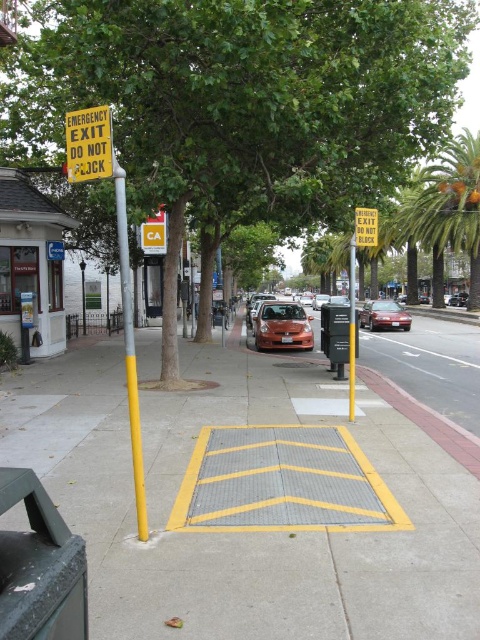
Question: Can you confirm if yellow textured pavement at center is wider than yellow metallic pole at center?

Choices:
 (A) no
 (B) yes

Answer: (A)

Question: Which point is closer to the camera?

Choices:
 (A) green leafy tree at center
 (B) yellow paper sign at upper left

Answer: (B)

Question: Which object is positioned farthest from the shiny red car at center?

Choices:
 (A) yellow plastic sign at upper center
 (B) yellow textured pavement at center
 (C) yellow metallic pole at center
 (D) yellow paper sign at upper left

Answer: (D)

Question: Observing the image, what is the correct spatial positioning of green leafy tree at center in reference to shiny red car at center?

Choices:
 (A) left
 (B) right

Answer: (A)

Question: Estimate the real-world distances between objects in this image. Which object is closer to the yellow paper sign at upper left?

Choices:
 (A) yellow textured pavement at center
 (B) green leafy tree at center
 (C) shiny red car at center
 (D) yellow plastic sign at upper center

Answer: (D)

Question: Can you confirm if yellow paper sign at upper left is positioned to the left of yellow metallic pole at center?

Choices:
 (A) no
 (B) yes

Answer: (B)